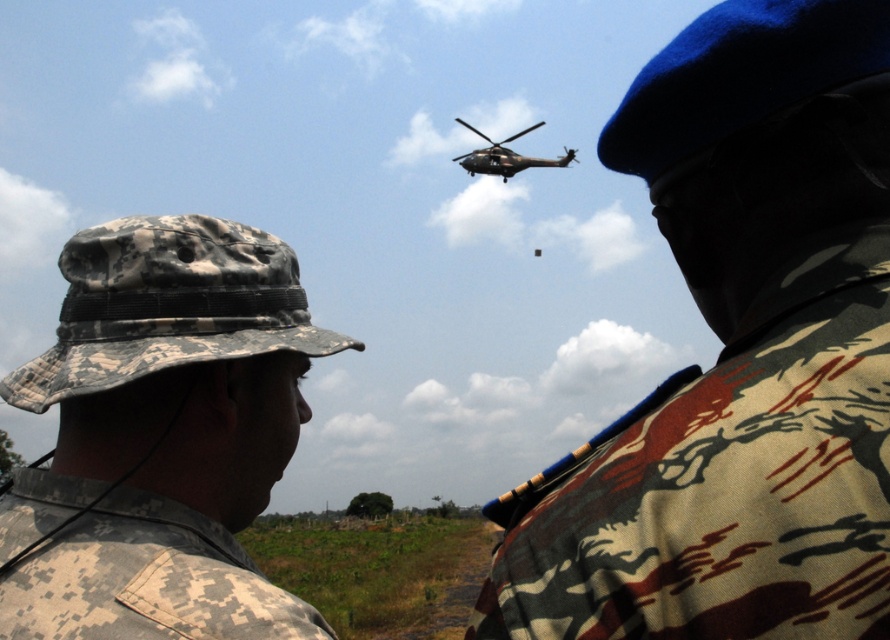
You are standing in front of the two military personnel and want to determine which of the two points, point (787, 218) or point (143, 356), is nearer to you. Based on the scene, which point is closer?

Point (787, 218) is closer to the viewer than point (143, 356).

You are a drone operator trying to capture a photo of both point (271,264) and point (132,600) in the scene. Which point should you focus on first to ensure both are in frame?

Point (271,264) is further to the camera than point (132,600). To ensure both are in frame, focus on point (271,264) first as it is closer to the camera, allowing the drone to adjust for the depth between the two points.

You are a photographer trying to capture a photo of the camo fabric uniform at upper right and the digital camouflage hat at left. Which object should you focus on first if you want to include both in your frame without moving the camera?

You should focus on the digital camouflage hat at left first because it is lower in the frame and closer to the bottom, allowing you to include both the camo fabric uniform at upper right and the digital camouflage hat at left in the same shot without moving the camera.